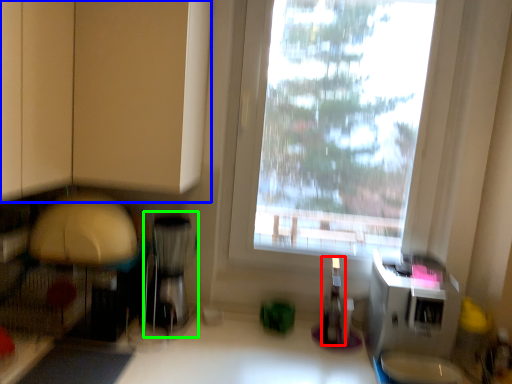
Question: Which object is positioned farthest from bottle (highlighted by a red box)? Select from cabinetry (highlighted by a blue box) and appliance (highlighted by a green box).

Choices:
 (A) cabinetry
 (B) appliance

Answer: (A)